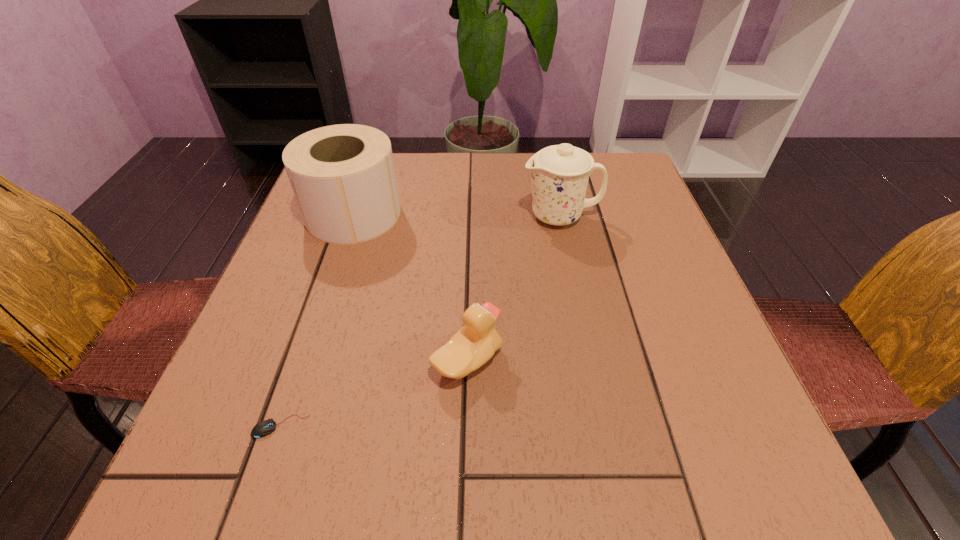
Where is `chinaware`? Image resolution: width=960 pixels, height=540 pixels. chinaware is located at coordinates (560, 173).

Locate an element on the screen. The image size is (960, 540). toilet tissue is located at coordinates (343, 177).

The width and height of the screenshot is (960, 540). Find the location of `the second nearest object`. the second nearest object is located at coordinates click(x=475, y=343).

Find the location of a particular element. the third object from left to right is located at coordinates (475, 343).

Where is `mouse`? mouse is located at coordinates (264, 428).

Where is `the shortest object`? The width and height of the screenshot is (960, 540). the shortest object is located at coordinates (264, 428).

Where is `vacant space located on the spout of the rightmost object`? Image resolution: width=960 pixels, height=540 pixels. vacant space located on the spout of the rightmost object is located at coordinates (392, 217).

Where is `vacant area located 0.360m on the spout of the rightmost object`? This screenshot has height=540, width=960. vacant area located 0.360m on the spout of the rightmost object is located at coordinates (366, 217).

Find the location of a particular element. This screenshot has width=960, height=540. free space located on the spout of the rightmost object is located at coordinates (495, 217).

Find the location of `free space located 0.150m on the front of the toilet tissue`. free space located 0.150m on the front of the toilet tissue is located at coordinates (325, 296).